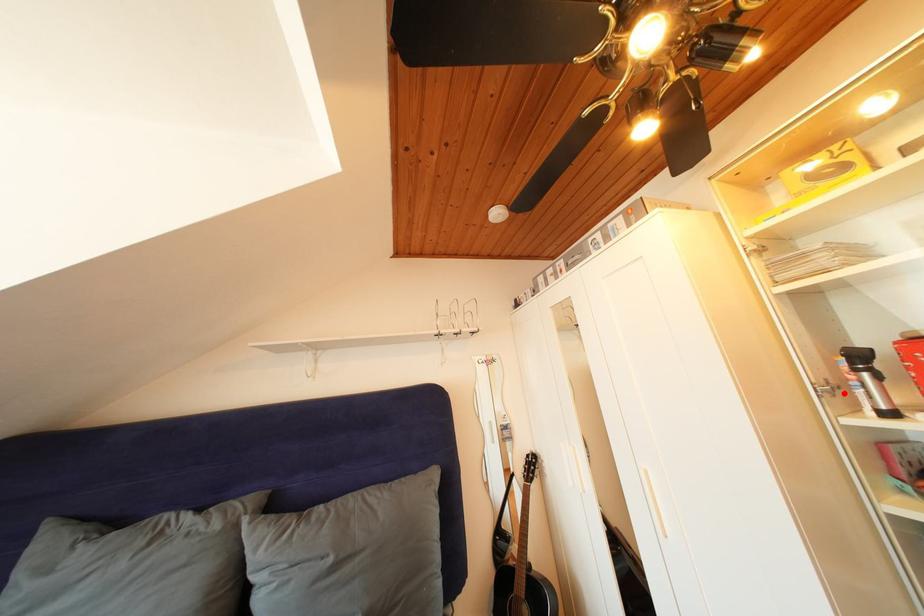
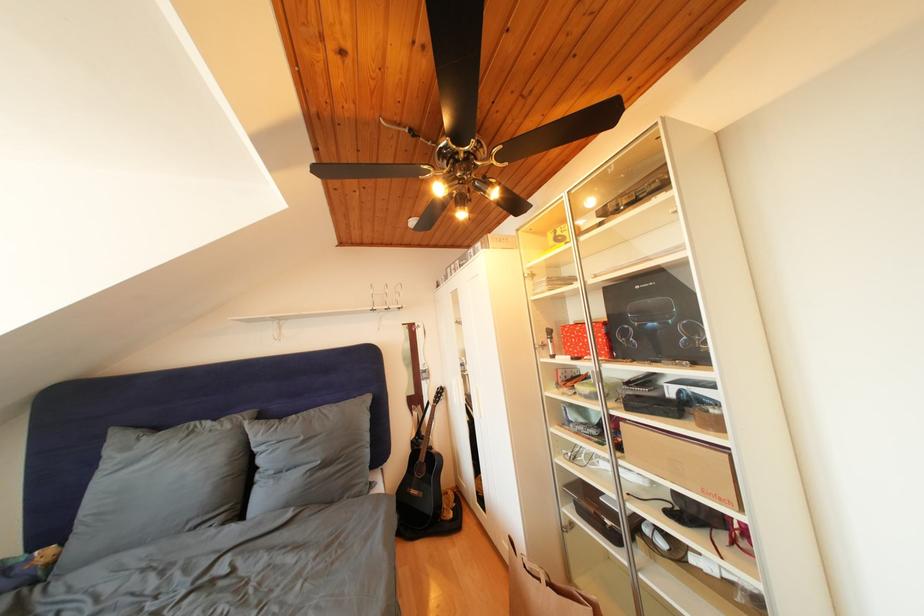
Locate, in the second image, the point that corresponds to the highlighted location in the first image.

(552, 351)